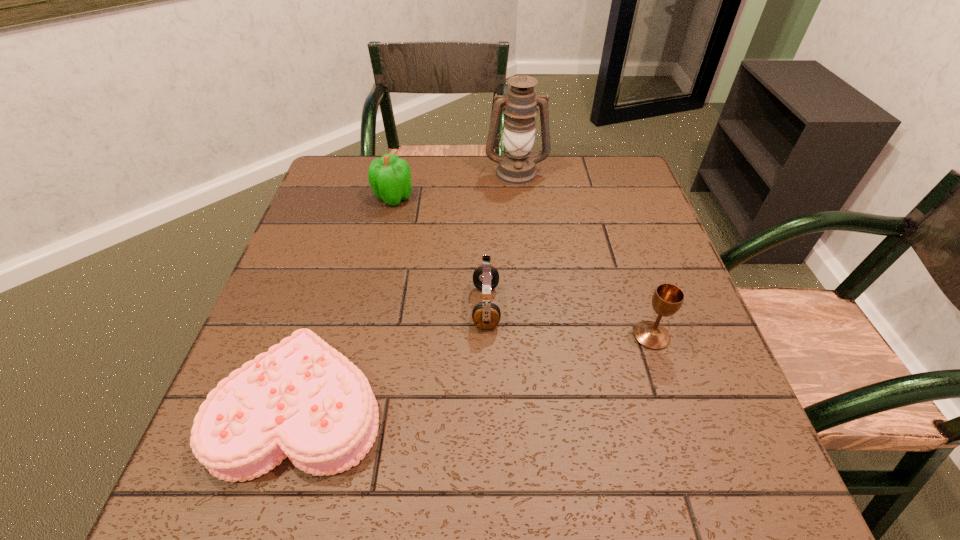
Where is `empty location between the oil lamp and the headset`? The image size is (960, 540). empty location between the oil lamp and the headset is located at coordinates (501, 240).

Identify the location of vacant region between the oil lamp and the chalice. This screenshot has width=960, height=540. (584, 254).

Identify the location of free point between the headset and the shortest object. (395, 356).

Identify the location of free space between the rightmost object and the headset. (568, 321).

At what (x,y) coordinates should I click in order to perform the action: click on free spot between the shortest object and the chalice. Please return your answer as a coordinate pair (x, y). Image resolution: width=960 pixels, height=540 pixels. Looking at the image, I should click on (477, 371).

Find the location of a particular element. The height and width of the screenshot is (540, 960). vacant space in between the oil lamp and the shortest object is located at coordinates (409, 289).

This screenshot has height=540, width=960. I want to click on free space between the headset and the rightmost object, so click(x=568, y=321).

Locate which object is the fourth closest to the headset. Please provide its 2D coordinates. Your answer should be formatted as a tuple, i.e. [(x, y)], where the tuple contains the x and y coordinates of a point satisfying the conditions above.

[(516, 167)]

Select which object is the third closest to the oil lamp. Please provide its 2D coordinates. Your answer should be formatted as a tuple, i.e. [(x, y)], where the tuple contains the x and y coordinates of a point satisfying the conditions above.

[(667, 299)]

Identify the location of vacant region that satisfies the following two spatial constraints: 1. on the front side of the farthest object; 2. on the ear cups of the headset. (530, 307).